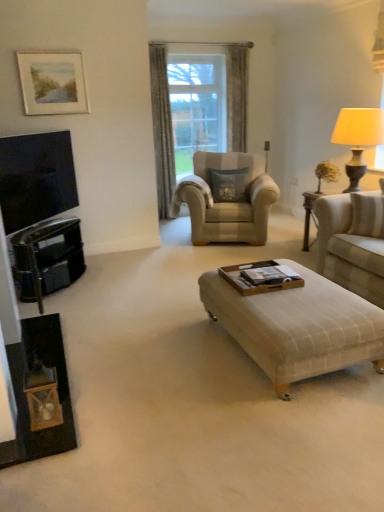
Where is `free spot above plaid fabric ottoman at center (from a real-world perspective)`? The image size is (384, 512). free spot above plaid fabric ottoman at center (from a real-world perspective) is located at coordinates (286, 298).